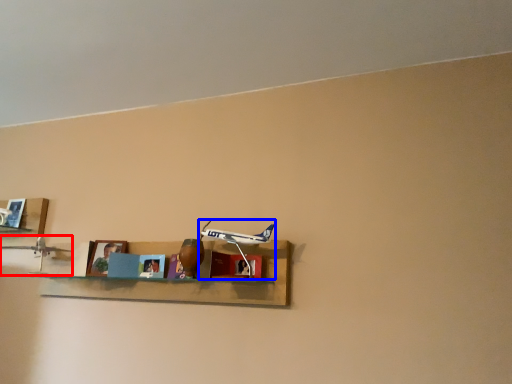
Question: Which object appears closest to the camera in this image, toy (highlighted by a red box) or toy (highlighted by a blue box)?

Choices:
 (A) toy
 (B) toy

Answer: (B)